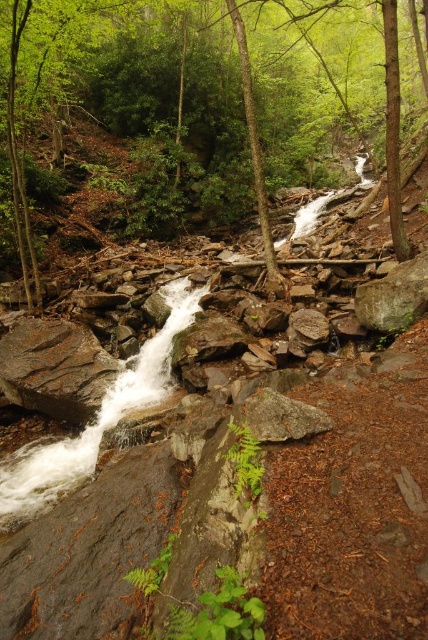
Question: Is green leafy tree at center smaller than rusty metallic rock at lower left?

Choices:
 (A) no
 (B) yes

Answer: (A)

Question: Can you confirm if green leafy tree at center is positioned to the left of rusty metallic rock at lower left?

Choices:
 (A) yes
 (B) no

Answer: (B)

Question: Which point appears farthest from the camera in this image?

Choices:
 (A) (77, 416)
 (B) (133, 172)

Answer: (B)

Question: Which point is closer to the camera?

Choices:
 (A) green leafy tree at center
 (B) rusty metallic rock at lower left

Answer: (B)

Question: Is green leafy tree at center smaller than rusty metallic rock at lower left?

Choices:
 (A) yes
 (B) no

Answer: (B)